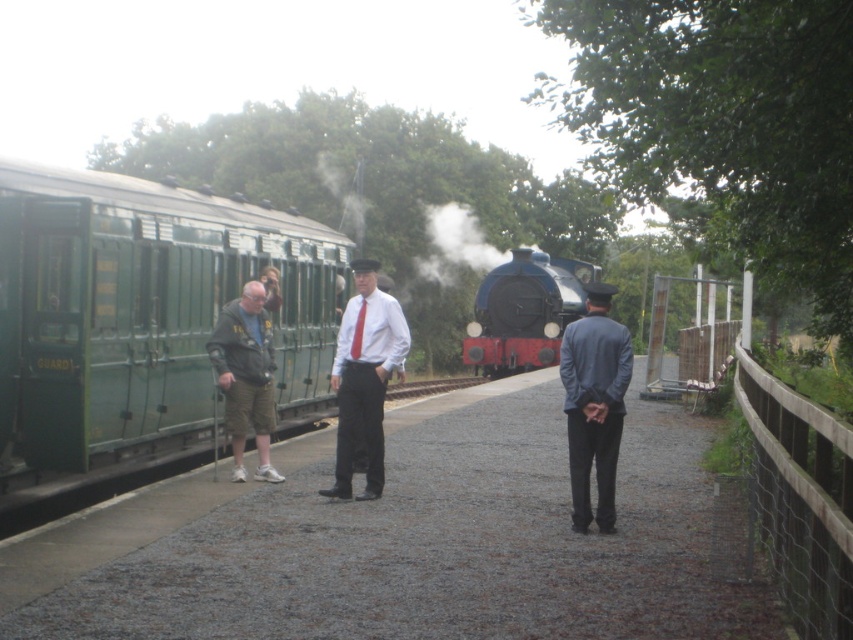
You are standing at the point marked as point (595, 403) in the railway station scene. What object is exactly at your current position?

The dark blue suit at center is located at point (595, 403), so the object exactly at your current position is the dark blue suit at center.

You are standing at the railway station platform and see two points marked on the platform. The first point is at coordinates point (480, 330) and the second point is at point (370, 364). Which point is closer to you?

Point (480, 330) is further to the viewer than point (370, 364), so the point closer to you is point (370, 364).

You are a photographer standing on the platform. You want to take a photo of the dark blue suit at center and the shiny blue locomotive at center such that both are fully visible in the frame. Given that your camera has a fixed focal length, which object should you position closer to the camera to ensure both fit in the frame?

To ensure both the dark blue suit at center and the shiny blue locomotive at center fit in the frame, you should position the dark blue suit at center closer to the camera since it has a smaller width than the shiny blue locomotive at center. This way, the smaller object will appear proportionally sized alongside the larger one in the photo.